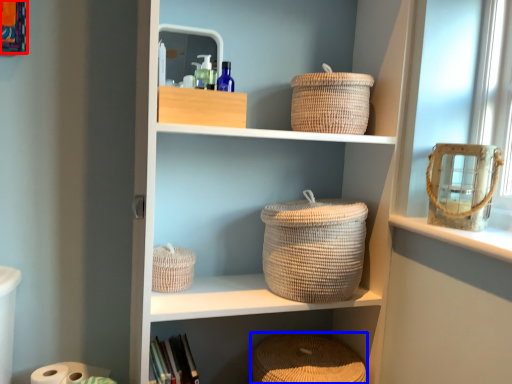
Question: Which object is further to the camera taking this photo, picture frame (highlighted by a red box) or basket (highlighted by a blue box)?

Choices:
 (A) picture frame
 (B) basket

Answer: (B)